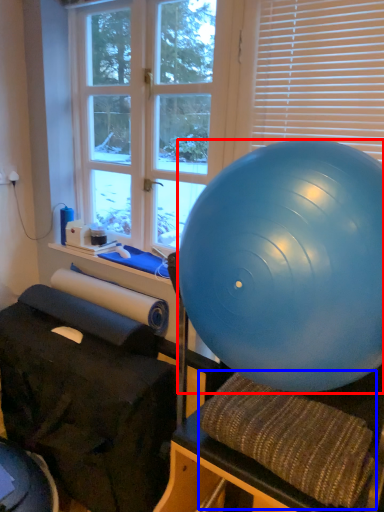
Question: Which point is closer to the camera, ball (highlighted by a red box) or bean bag chair (highlighted by a blue box)?

Choices:
 (A) ball
 (B) bean bag chair

Answer: (A)